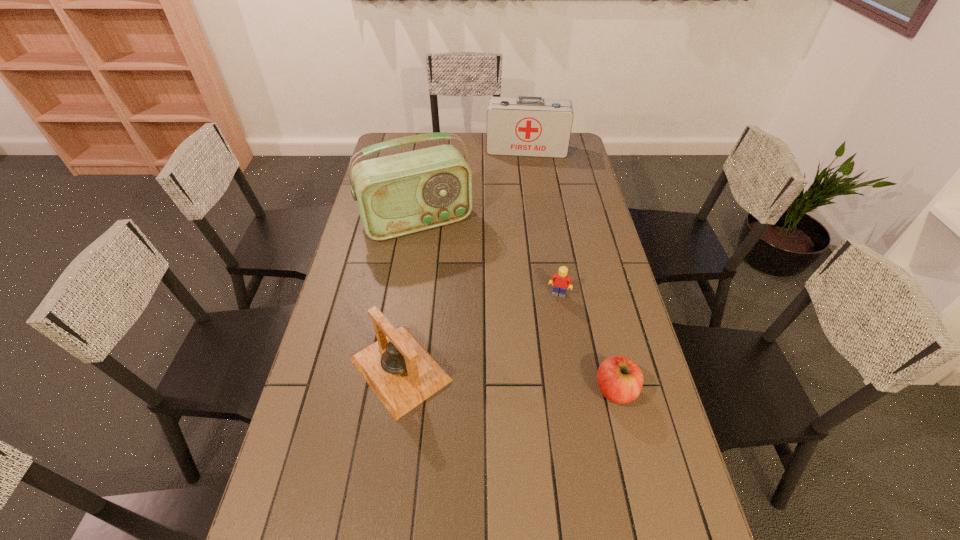
The height and width of the screenshot is (540, 960). What are the coordinates of `vacant space on the desktop that is between the third shortest object and the apple and is positioned on the front panel of the fourth nearest object` in the screenshot? It's located at (493, 379).

The image size is (960, 540). Find the location of `vacant spot on the desktop that is between the bell and the apple and is positioned on the front-facing side of the Lego`. vacant spot on the desktop that is between the bell and the apple and is positioned on the front-facing side of the Lego is located at coordinates (532, 382).

Find the location of a particular element. This screenshot has width=960, height=540. vacant space on the desktop that is between the third shortest object and the apple and is positioned on the front-facing side of the second tallest object is located at coordinates (520, 381).